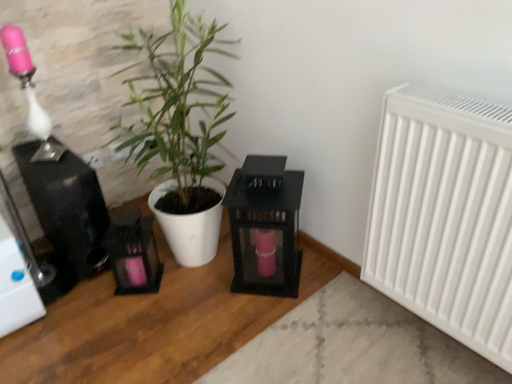
Image resolution: width=512 pixels, height=384 pixels. In order to click on vacant area that lies in front of black glass lantern at center in this screenshot , I will do `click(267, 319)`.